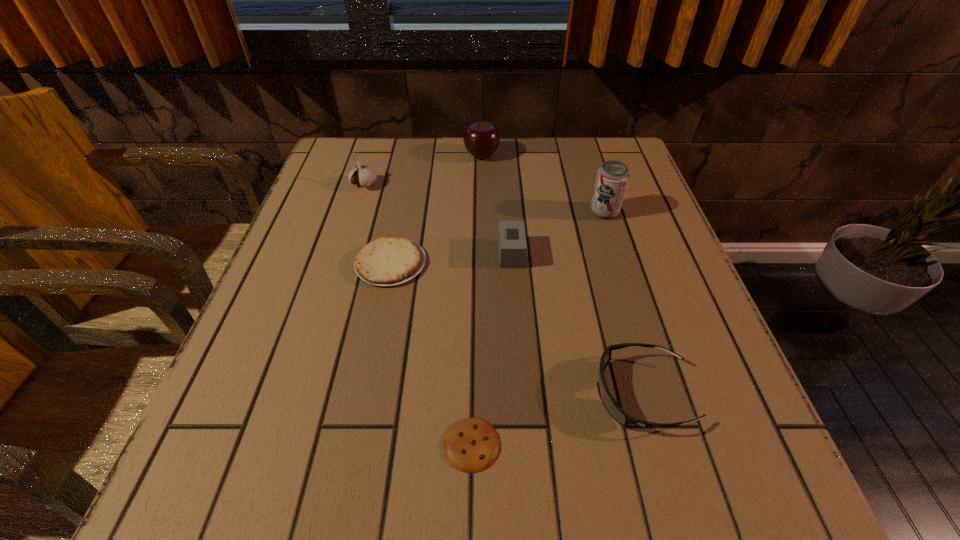
I want to click on the tallest object, so click(x=612, y=179).

In order to click on the fifth nearest object in this screenshot , I will do [612, 179].

This screenshot has width=960, height=540. What are the coordinates of `apple` in the screenshot? It's located at (481, 139).

What are the coordinates of `the second tallest object` in the screenshot? It's located at (481, 139).

The image size is (960, 540). Find the location of `garlic`. garlic is located at coordinates (364, 176).

The width and height of the screenshot is (960, 540). Find the location of `the third tallest object`. the third tallest object is located at coordinates (364, 176).

Find the location of a particular element. This screenshot has height=540, width=960. alarm clock is located at coordinates (512, 238).

This screenshot has width=960, height=540. I want to click on goggles, so click(x=609, y=402).

Where is `tortilla`? The height and width of the screenshot is (540, 960). tortilla is located at coordinates (391, 260).

Locate an element on the screen. cookie is located at coordinates (471, 445).